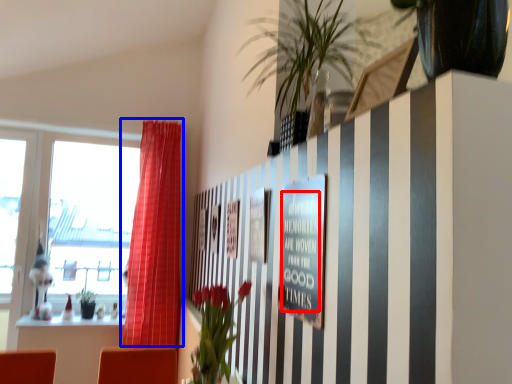
Question: Which object is closer to the camera taking this photo, writing (highlighted by a red box) or curtain (highlighted by a blue box)?

Choices:
 (A) writing
 (B) curtain

Answer: (A)